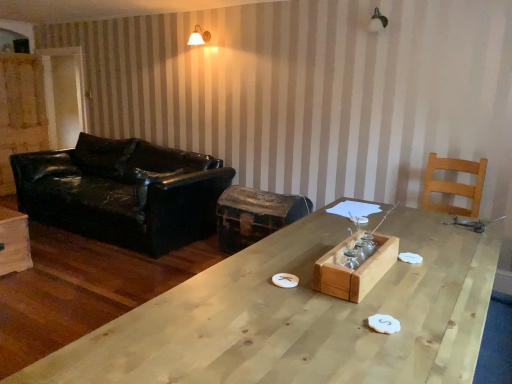
What are the coordinates of `vacant point to the right of wooden tray at center` in the screenshot? It's located at (433, 280).